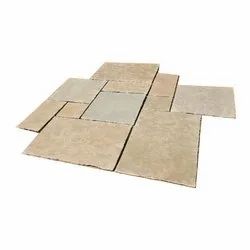
Where is `medium sized tiles`? This screenshot has width=250, height=250. medium sized tiles is located at coordinates (204, 100), (130, 70), (116, 104), (68, 83).